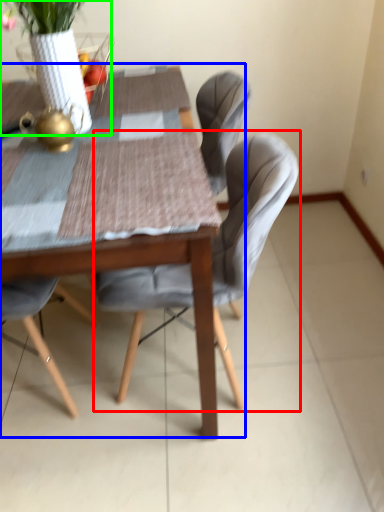
Question: Estimate the real-world distances between objects in this image. Which object is farther from chair (highlighted by a red box), kitchen & dining room table (highlighted by a blue box) or floral arrangement (highlighted by a green box)?

Choices:
 (A) kitchen & dining room table
 (B) floral arrangement

Answer: (B)